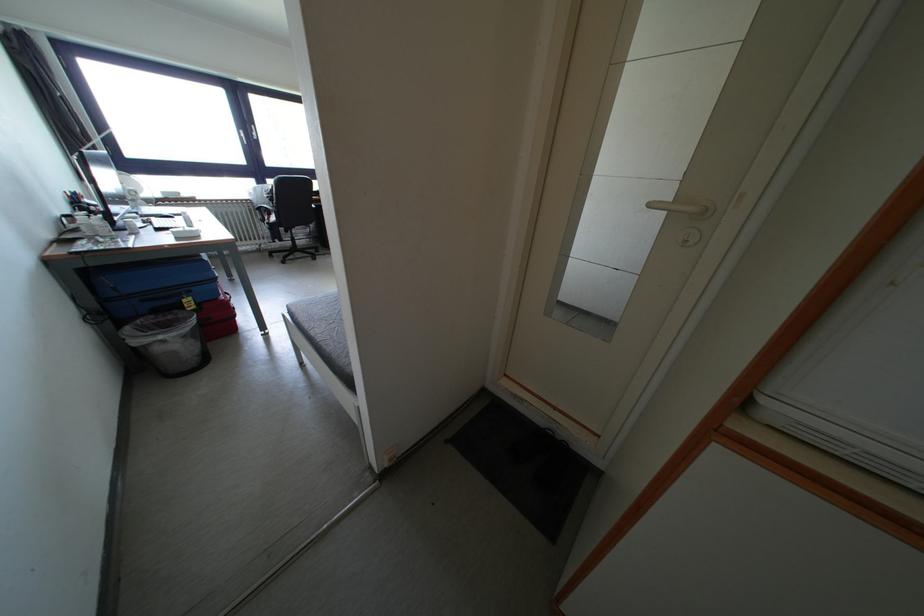
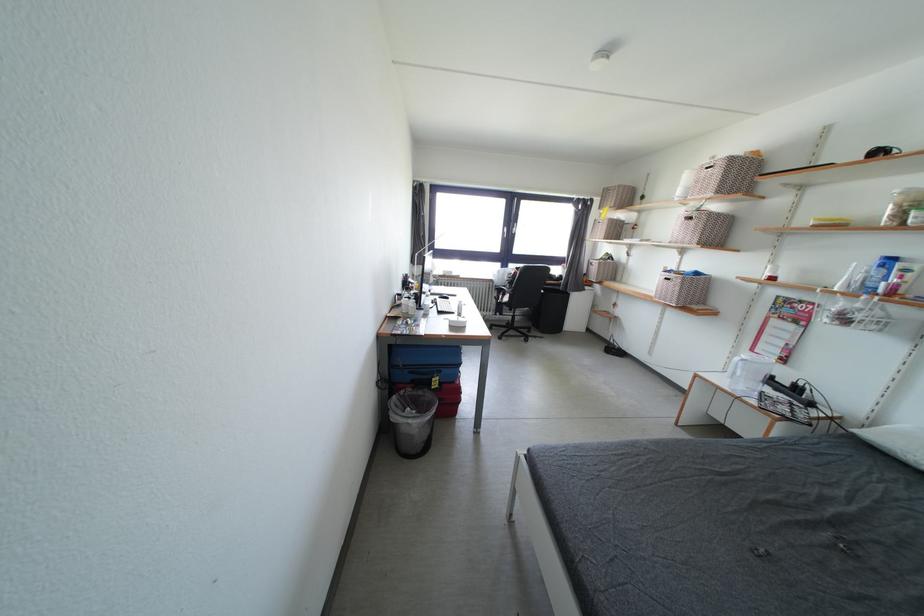
Question: I am providing you with two images of the same scene from different viewpoints. After the viewpoint changes to image2, which objects are now occluded?

Choices:
 (A) black sunglasses
 (B) black window handle
 (C) patterned box handle
 (D) none of these

Answer: (D)